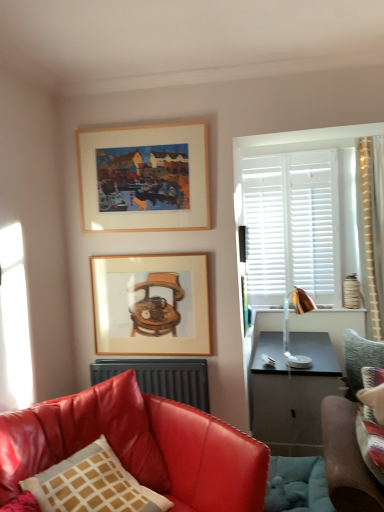
Question: Should I look upward or downward to see matte white pillow with brown grid at lower left?

Choices:
 (A) down
 (B) up

Answer: (A)

Question: Does velvet green sofa at right, positioned as the 2th studio couch in left-to-right order, touch wooden framed picture at center, acting as the 1th picture frame starting from the bottom?

Choices:
 (A) yes
 (B) no

Answer: (B)

Question: Is velvet green sofa at right, positioned as the 2th studio couch in left-to-right order, aimed at wooden framed picture at center, the 2th picture frame viewed from the top?

Choices:
 (A) yes
 (B) no

Answer: (B)

Question: Can you confirm if velvet green sofa at right, positioned as the 2th studio couch in left-to-right order, is wider than wooden framed picture at center, the 2th picture frame viewed from the top?

Choices:
 (A) no
 (B) yes

Answer: (B)

Question: Is velvet green sofa at right, positioned as the 2th studio couch in left-to-right order, to the left of wooden framed picture at center, the 2th picture frame viewed from the top, from the viewer's perspective?

Choices:
 (A) no
 (B) yes

Answer: (A)

Question: Does velvet green sofa at right, which ranks as the second studio couch in front-to-back order, have a smaller size compared to wooden framed picture at center, acting as the 1th picture frame starting from the bottom?

Choices:
 (A) no
 (B) yes

Answer: (A)

Question: Is velvet green sofa at right, positioned as the 2th studio couch in left-to-right order, far from wooden framed picture at center, the 2th picture frame viewed from the top?

Choices:
 (A) no
 (B) yes

Answer: (B)

Question: Is velvet green sofa at right, which ranks as the second studio couch in front-to-back order, behind matte white pillow with brown grid at lower left?

Choices:
 (A) no
 (B) yes

Answer: (B)

Question: Considering the relative positions of velvet green sofa at right, the 1th studio couch in the right-to-left sequence, and matte white pillow with brown grid at lower left in the image provided, is velvet green sofa at right, the 1th studio couch in the right-to-left sequence, to the left of matte white pillow with brown grid at lower left from the viewer's perspective?

Choices:
 (A) no
 (B) yes

Answer: (A)

Question: Can you confirm if velvet green sofa at right, the first studio couch from the back, is positioned to the right of matte white pillow with brown grid at lower left?

Choices:
 (A) yes
 (B) no

Answer: (A)

Question: Can you confirm if velvet green sofa at right, the 1th studio couch in the right-to-left sequence, is taller than matte white pillow with brown grid at lower left?

Choices:
 (A) yes
 (B) no

Answer: (A)

Question: From the image's perspective, is velvet green sofa at right, the 1th studio couch in the right-to-left sequence, on matte white pillow with brown grid at lower left?

Choices:
 (A) yes
 (B) no

Answer: (A)

Question: From a real-world perspective, is velvet green sofa at right, positioned as the 2th studio couch in left-to-right order, on matte white pillow with brown grid at lower left?

Choices:
 (A) yes
 (B) no

Answer: (B)

Question: Is the position of dark gray metallic radiator at lower center more distant than that of wooden framed picture at center, the 2th picture frame viewed from the top?

Choices:
 (A) no
 (B) yes

Answer: (A)